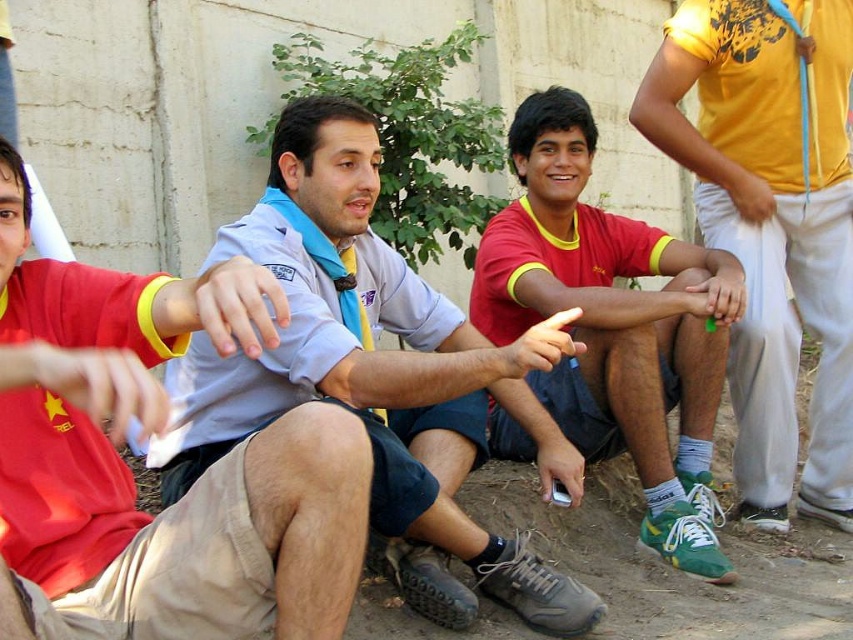
Question: Does light blue shirt at center have a greater width compared to light blue fabric shirt at center?

Choices:
 (A) yes
 (B) no

Answer: (B)

Question: Which object is farther from the camera taking this photo?

Choices:
 (A) light blue shirt at center
 (B) light blue fabric shirt at center
 (C) yellow cotton shirt at upper right

Answer: (C)

Question: Based on their relative distances, which object is farther from the light blue shirt at center?

Choices:
 (A) yellow cotton shirt at upper right
 (B) light blue fabric shirt at center

Answer: (A)

Question: Does light blue shirt at center appear over yellow cotton shirt at upper right?

Choices:
 (A) no
 (B) yes

Answer: (A)

Question: Does light blue shirt at center appear on the right side of red/yellow jersey at center?

Choices:
 (A) yes
 (B) no

Answer: (B)

Question: Which point appears farthest from the camera in this image?

Choices:
 (A) (469, 417)
 (B) (625, 262)

Answer: (B)